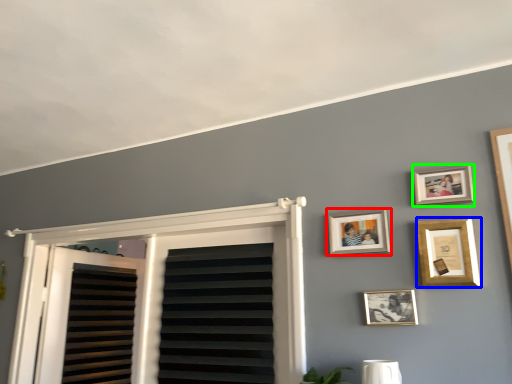
Question: Estimate the real-world distances between objects in this image. Which object is closer to picture frame (highlighted by a red box), picture frame (highlighted by a blue box) or picture frame (highlighted by a green box)?

Choices:
 (A) picture frame
 (B) picture frame

Answer: (A)